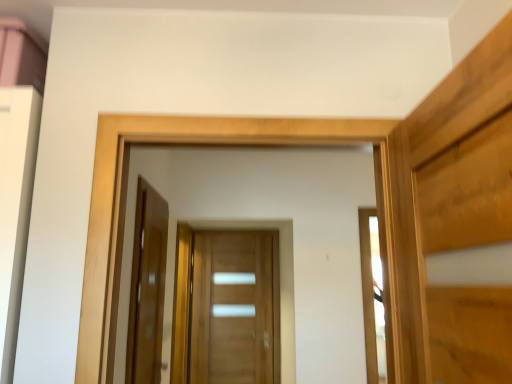
Question: Is glossy wood door at center, the 2th door from the back, far away from wooden door at center, the first door from the back?

Choices:
 (A) no
 (B) yes

Answer: (B)

Question: Is the depth of glossy wood door at center, the 2th door from the back, greater than that of wooden door at center, the 2th door in the front-to-back sequence?

Choices:
 (A) yes
 (B) no

Answer: (B)

Question: Considering the relative sizes of glossy wood door at center, the 2th door from the back, and wooden door at center, the first door from the back, in the image provided, is glossy wood door at center, the 2th door from the back, shorter than wooden door at center, the first door from the back,?

Choices:
 (A) yes
 (B) no

Answer: (A)

Question: Is glossy wood door at center, placed as the 1th door when sorted from left to right, at the left side of wooden door at center, the 2th door in the front-to-back sequence?

Choices:
 (A) yes
 (B) no

Answer: (A)

Question: From the image's perspective, would you say glossy wood door at center, placed as the 1th door when sorted from left to right, is shown under wooden door at center, the first door from the back?

Choices:
 (A) no
 (B) yes

Answer: (A)

Question: Can you confirm if glossy wood door at center, placed as the 1th door when sorted from front to back, is wider than wooden door at center, positioned as the second door in left-to-right order?

Choices:
 (A) no
 (B) yes

Answer: (A)

Question: From a real-world perspective, is wooden door at center, positioned as the second door in left-to-right order, physically above glossy wood door at center, placed as the 1th door when sorted from front to back?

Choices:
 (A) yes
 (B) no

Answer: (B)

Question: From a real-world perspective, is wooden door at center, the 2th door in the front-to-back sequence, located beneath glossy wood door at center, placed as the 1th door when sorted from front to back?

Choices:
 (A) no
 (B) yes

Answer: (B)

Question: Is wooden door at center, the 2th door in the front-to-back sequence, shorter than glossy wood door at center, the 2th door from the back?

Choices:
 (A) no
 (B) yes

Answer: (A)

Question: Is wooden door at center, the 2th door in the front-to-back sequence, not inside glossy wood door at center, the second door in the right-to-left sequence?

Choices:
 (A) no
 (B) yes

Answer: (B)

Question: Is wooden door at center, the 2th door in the front-to-back sequence, bigger than glossy wood door at center, placed as the 1th door when sorted from front to back?

Choices:
 (A) yes
 (B) no

Answer: (A)

Question: Is wooden door at center, acting as the 1th door starting from the right, oriented away from glossy wood door at center, the 2th door from the back?

Choices:
 (A) yes
 (B) no

Answer: (B)

Question: Looking at the image, does glossy wood door at center, placed as the 1th door when sorted from left to right, seem bigger or smaller compared to wooden door at center, acting as the 1th door starting from the right?

Choices:
 (A) big
 (B) small

Answer: (B)